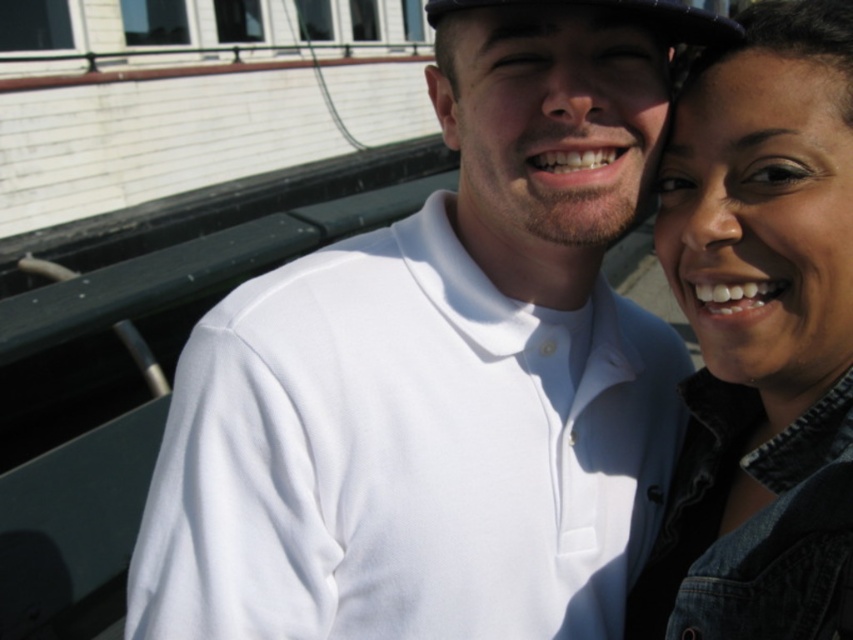
Is white matte shirt at center positioned before black fabric baseball hat at upper center?

No, white matte shirt at center is further to the viewer.

Can you confirm if white matte shirt at center is shorter than black fabric baseball hat at upper center?

No.

Measure the distance between point (x=204, y=563) and camera.

Point (x=204, y=563) is 1.75 meters from camera.

Image resolution: width=853 pixels, height=640 pixels. Find the location of `white matte shirt at center`. white matte shirt at center is located at coordinates (438, 380).

Can you confirm if denim jacket at upper right is positioned below black fabric baseball hat at upper center?

Correct, denim jacket at upper right is located below black fabric baseball hat at upper center.

Does denim jacket at upper right lie behind black fabric baseball hat at upper center?

No.

Who is more distant from viewer, (799, 618) or (657, 4)?

The point (657, 4) is behind.

At what (x,y) coordinates should I click in order to perform the action: click on denim jacket at upper right. Please return your answer as a coordinate pair (x, y). This screenshot has width=853, height=640. Looking at the image, I should click on [759, 337].

Can you confirm if white matte shirt at center is smaller than denim jacket at upper right?

No.

Is point (421, 353) closer to viewer compared to point (813, 552)?

No, it is behind (813, 552).

Between point (468, 132) and point (839, 284), which one is positioned behind?

Positioned behind is point (468, 132).

The height and width of the screenshot is (640, 853). Find the location of `white matte shirt at center`. white matte shirt at center is located at coordinates (438, 380).